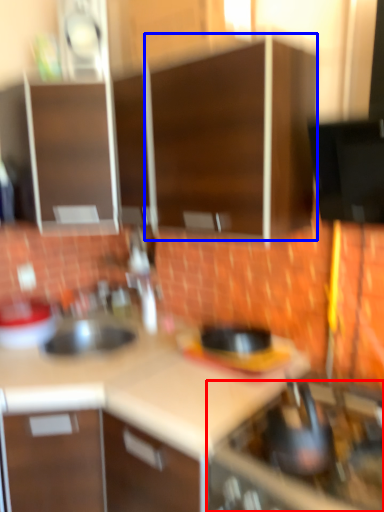
Question: Which object is further to the camera taking this photo, home appliance (highlighted by a red box) or cabinetry (highlighted by a blue box)?

Choices:
 (A) home appliance
 (B) cabinetry

Answer: (B)